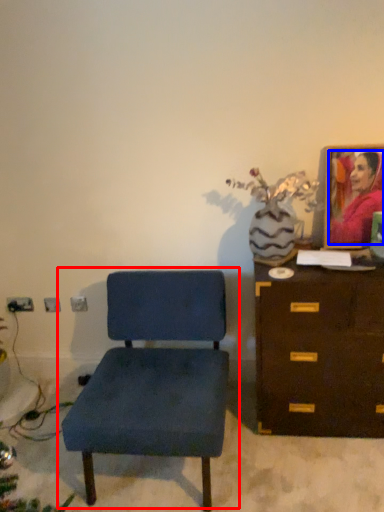
Question: Among these objects, which one is nearest to the camera, chair (highlighted by a red box) or person (highlighted by a blue box)?

Choices:
 (A) chair
 (B) person

Answer: (A)